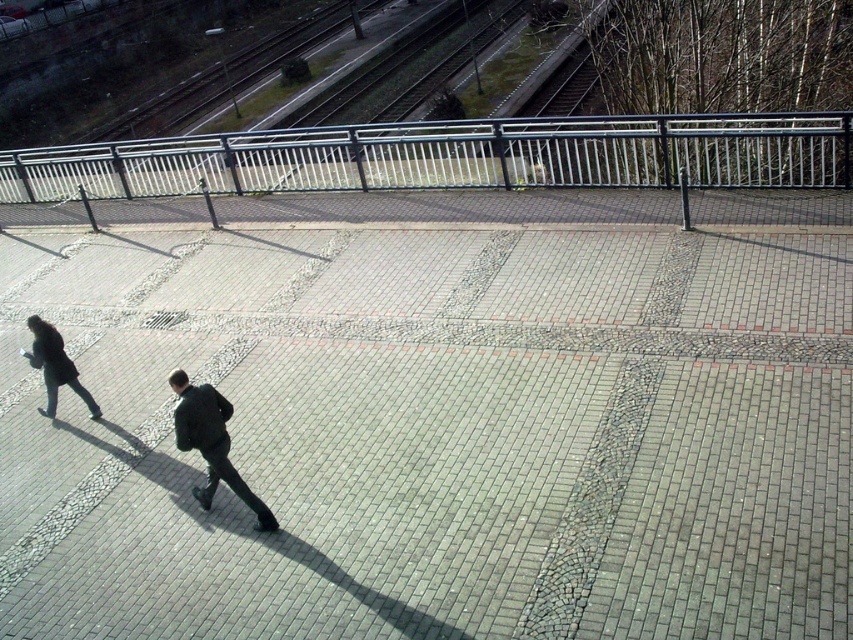
Question: Can you confirm if metallic silver fence at upper center is thinner than dark green jacket at center?

Choices:
 (A) yes
 (B) no

Answer: (B)

Question: Which point appears closest to the camera in this image?

Choices:
 (A) (193, 148)
 (B) (485, 417)
 (C) (184, 449)

Answer: (C)

Question: Is the position of metallic silver fence at upper center less distant than that of dark green jacket at center?

Choices:
 (A) no
 (B) yes

Answer: (A)

Question: Can you confirm if metallic silver fence at upper center is positioned below dark gray coat at lower left?

Choices:
 (A) yes
 (B) no

Answer: (B)

Question: Which of the following is the farthest from the observer?

Choices:
 (A) (578, 624)
 (B) (206, 445)

Answer: (B)

Question: Which point is farther from the camera taking this photo?

Choices:
 (A) (173, 195)
 (B) (573, 316)

Answer: (A)